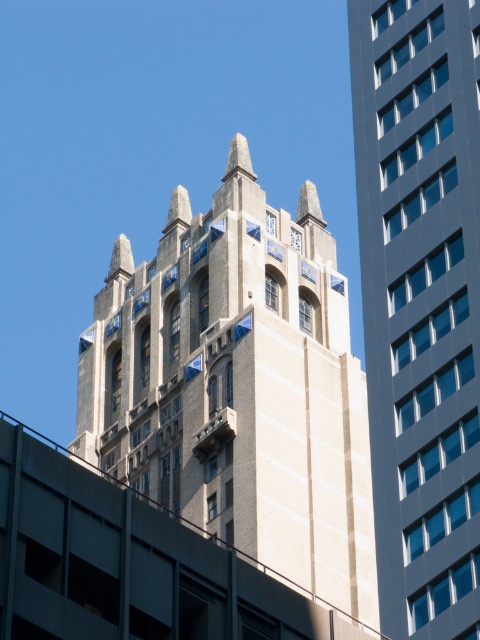
You are standing in front of the two buildings and want to take a photo that includes both. Which point, point 1 at coordinates (322, 474) or point 2 at coordinates (468, 134), is closer to you and should be prioritized in the foreground of your photo?

Point 1 at coordinates (322, 474) is closer to you and should be prioritized in the foreground of your photo because it is further to the camera than point 2 at coordinates (468, 134).

You are standing at the origin point in the image. Which direction should you look to see the beige stone tower at center?

The beige stone tower at center is located at coordinates approximately 0.603 on the x and 0.498 on the y axis, so you should look to the right and slightly upward from the origin point to see it.

You are an architect comparing two buildings in the image. The beige stone tower at center has a Gothic design, while the smooth gray building at center is modern. Which one is bigger in size?

The beige stone tower at center is larger in size than the smooth gray building at center.